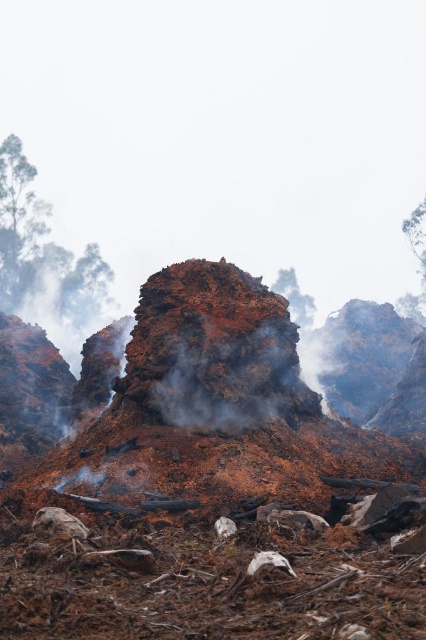
Can you confirm if rusty metallic rock at center is bigger than green leafy tree at left?

Actually, rusty metallic rock at center might be smaller than green leafy tree at left.

Is rusty metallic rock at center taller than green leafy tree at left?

No, rusty metallic rock at center is not taller than green leafy tree at left.

Does point (155, 332) come behind point (92, 268)?

No, it is in front of (92, 268).

In order to click on rusty metallic rock at center in this screenshot , I will do (x=213, y=348).